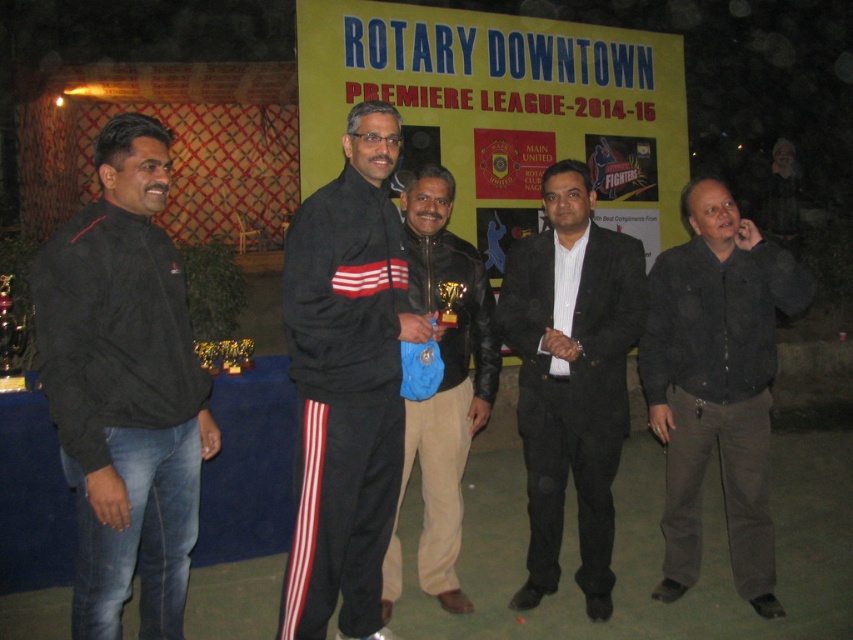
Question: Which of these objects is positioned farthest from the black matte suit at center?

Choices:
 (A) dark gray shirt at right
 (B) black track suit at center
 (C) brown leather jacket at center

Answer: (B)

Question: Considering the relative positions of black matte jacket at left and brown leather jacket at center in the image provided, where is black matte jacket at left located with respect to brown leather jacket at center?

Choices:
 (A) right
 (B) left

Answer: (B)

Question: Which of the following is the farthest from the observer?

Choices:
 (A) black matte jacket at left
 (B) dark gray shirt at right

Answer: (B)

Question: Which of the following is the closest to the observer?

Choices:
 (A) (622, 353)
 (B) (137, 467)
 (C) (372, 131)

Answer: (B)

Question: Can you confirm if black matte jacket at left is wider than dark gray shirt at right?

Choices:
 (A) no
 (B) yes

Answer: (A)

Question: Does black matte jacket at left appear on the right side of brown leather jacket at center?

Choices:
 (A) yes
 (B) no

Answer: (B)